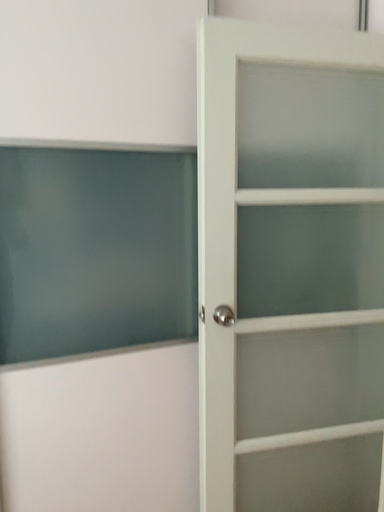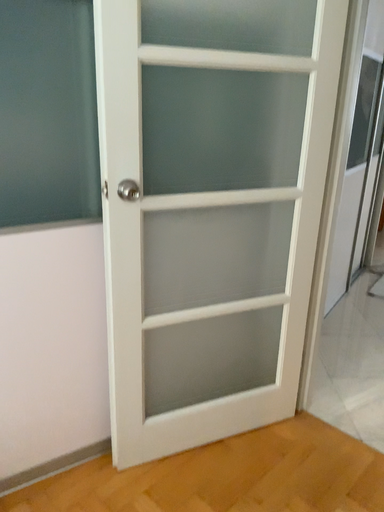
Question: Which way did the camera rotate in the video?

Choices:
 (A) rotated downward
 (B) rotated upward

Answer: (A)